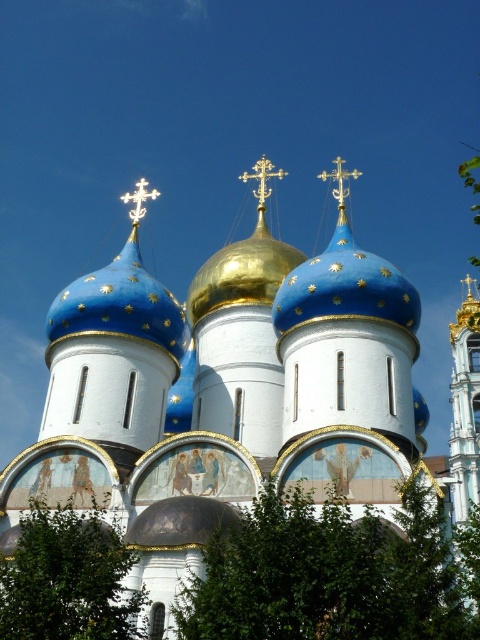
You are an architect examining the cathedral design. You notice the blue glossy dome at upper center. Where exactly is it positioned in the image coordinates?

The blue glossy dome at upper center is located at point coordinates of 0.480 in the x axis and 0.250 in the y axis.

You are standing in front of the cathedral with three onion domes. There is a specific point marked at coordinates point (x=168, y=326). If you want to move closer to this point, which direction should you move in relation to the cathedral?

The point (x=168, y=326) is 65.11 meters away from the viewer. To move closer to this point, you should move forward towards the cathedral.